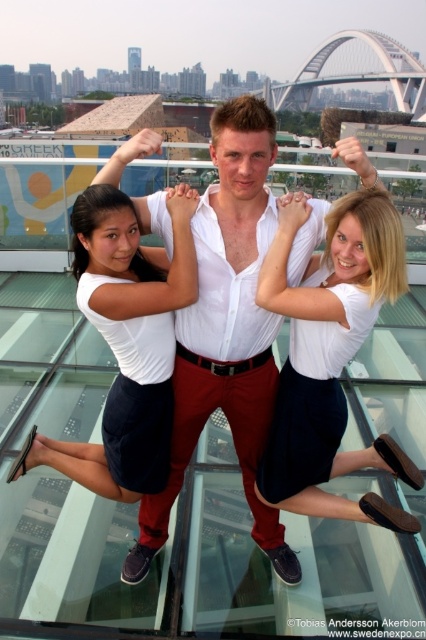
You are standing at the point labeled point [129,305] and want to walk to the point labeled point [270,476]. Is there any obstacle between you and your destination?

Yes, the point labeled point [129,305] is in front of the point labeled point [270,476], so there is an obstacle between them.

You are standing on the glass floor and looking down at the two white cotton items. Which one appears closer to you, the white cotton skirt at center or the white cotton shirt at center?

The white cotton skirt at center is closer to the viewer than the white cotton shirt at center.